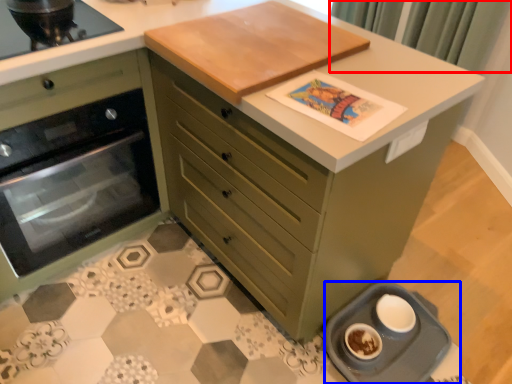
Question: Which point is closer to the camera, curtain (highlighted by a red box) or appliance (highlighted by a blue box)?

Choices:
 (A) curtain
 (B) appliance

Answer: (B)